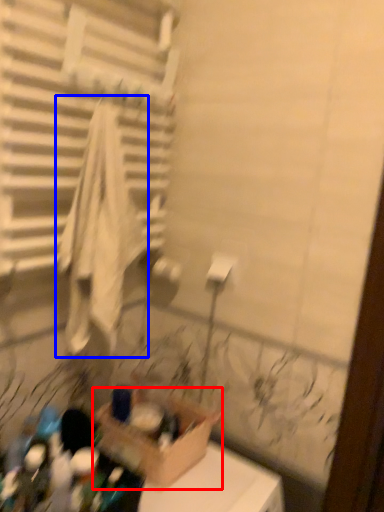
Question: Which object is closer to the camera taking this photo, cardboard box (highlighted by a red box) or bath towel (highlighted by a blue box)?

Choices:
 (A) cardboard box
 (B) bath towel

Answer: (B)